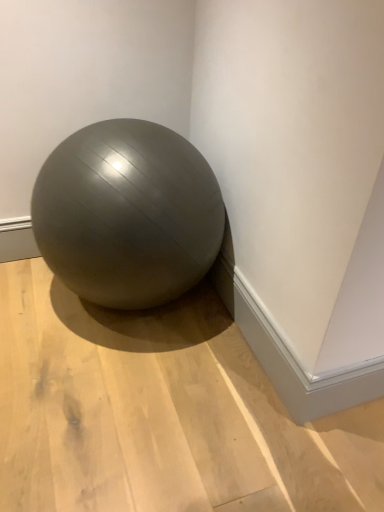
Where is `free spot above matte gray ball at center (from a real-world perspective)`? Image resolution: width=384 pixels, height=512 pixels. free spot above matte gray ball at center (from a real-world perspective) is located at coordinates (163, 401).